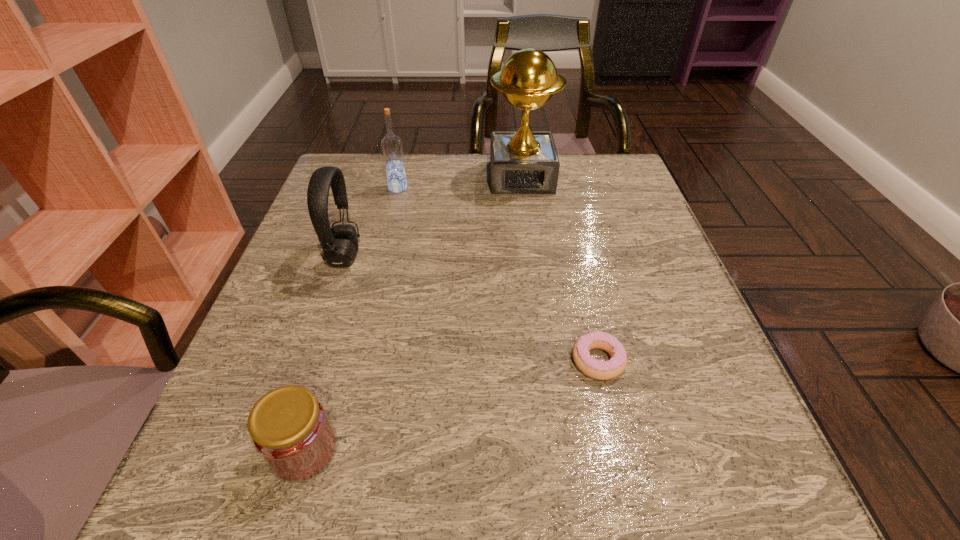
Locate an element on the screen. The image size is (960, 540). free location that satisfies the following two spatial constraints: 1. on the front-facing side of the fourth tallest object; 2. on the left side of the headset is located at coordinates (279, 450).

Identify the location of free spot that satisfies the following two spatial constraints: 1. on the front-facing side of the tallest object; 2. on the left side of the fourth farthest object. The image size is (960, 540). (544, 361).

Locate an element on the screen. The height and width of the screenshot is (540, 960). free space in the image that satisfies the following two spatial constraints: 1. on the front-facing side of the doughnut; 2. on the left side of the headset is located at coordinates (310, 361).